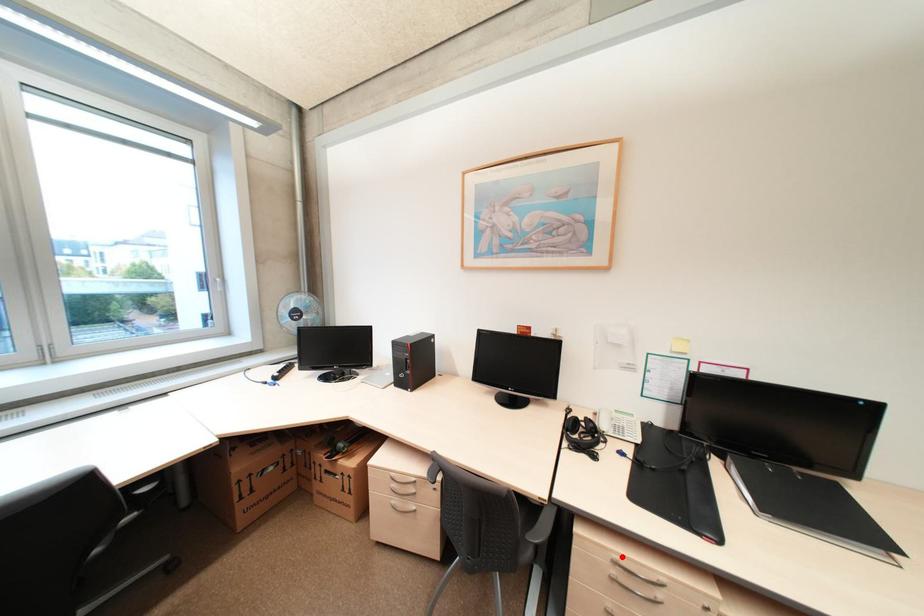
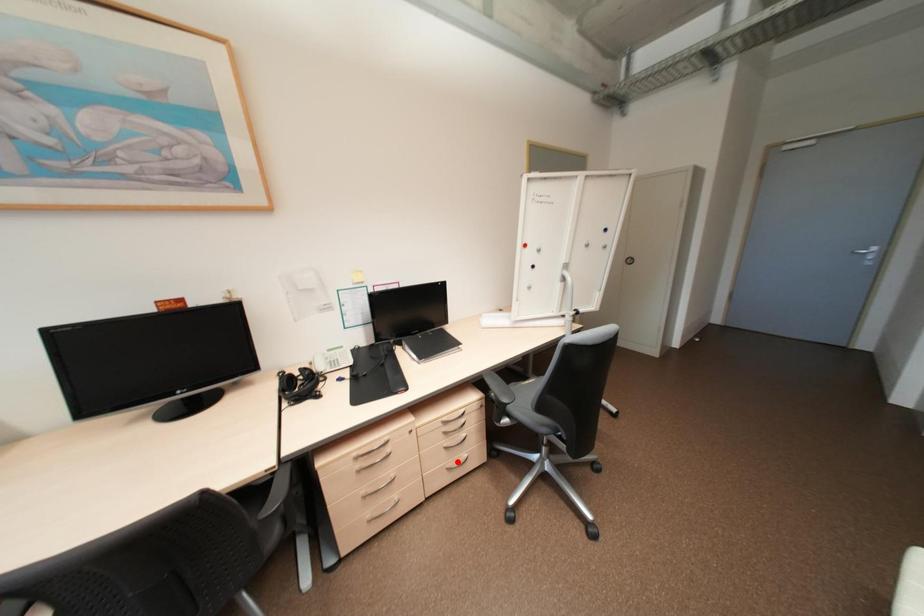
I am providing you with two images of the same scene from different viewpoints. A red point is marked on the first image and another point is marked on the second image. Does the point marked in image1 correspond to the same location as the one in image2?

No